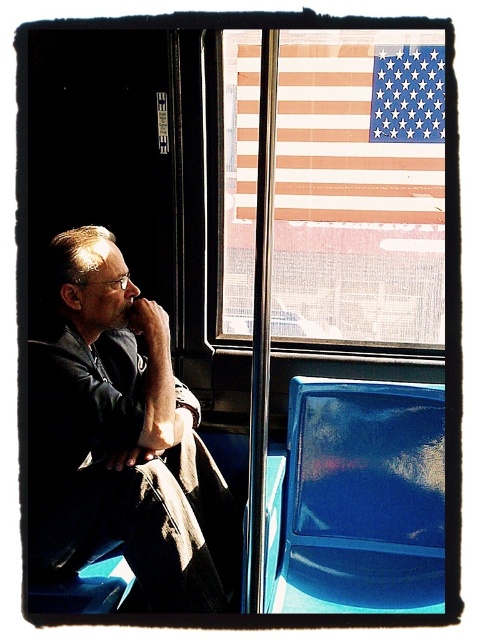
You are a photographer trying to capture a shot of the matte black coat at left and the american flag at upper right through the window. Which object is closer to the left edge of the window frame?

The matte black coat at left is positioned on the left side of the american flag at upper right, so it is closer to the left edge of the window frame.

You are a passenger on a train and want to place a small bag between the matte black coat at left and the glossy blue seat at lower right. Can you fit it there?

The matte black coat at left is to the left of glossy blue seat at lower right, so there is space between them where the bag can be placed.

You are a passenger on a train and want to know if you can reach the american flag at upper right from your current position on the glossy blue seat at lower right. Considering their heights, can you touch the flag?

The glossy blue seat at lower right is shorter than the american flag at upper right, so if you are sitting on the glossy blue seat at lower right, you might not be able to reach the american flag at upper right due to the height difference.